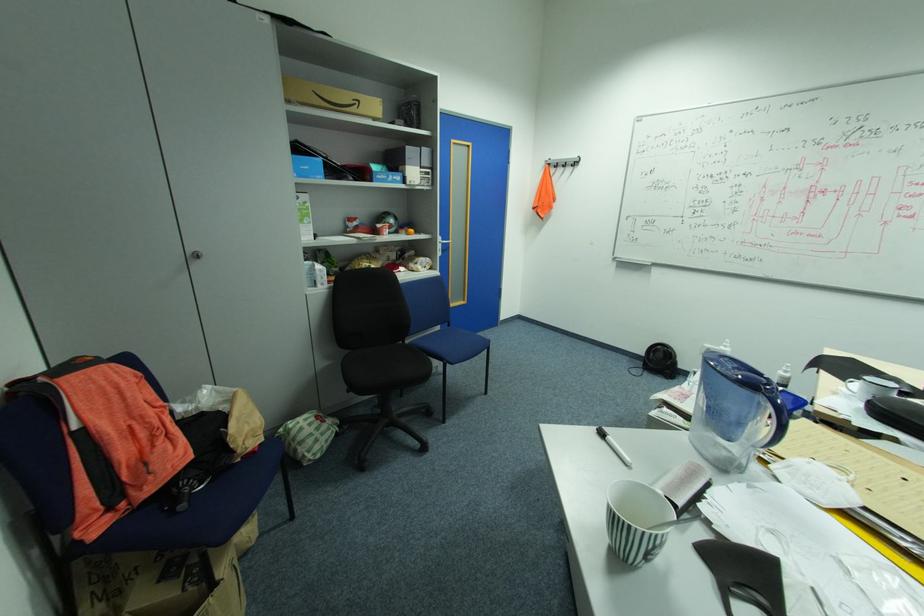
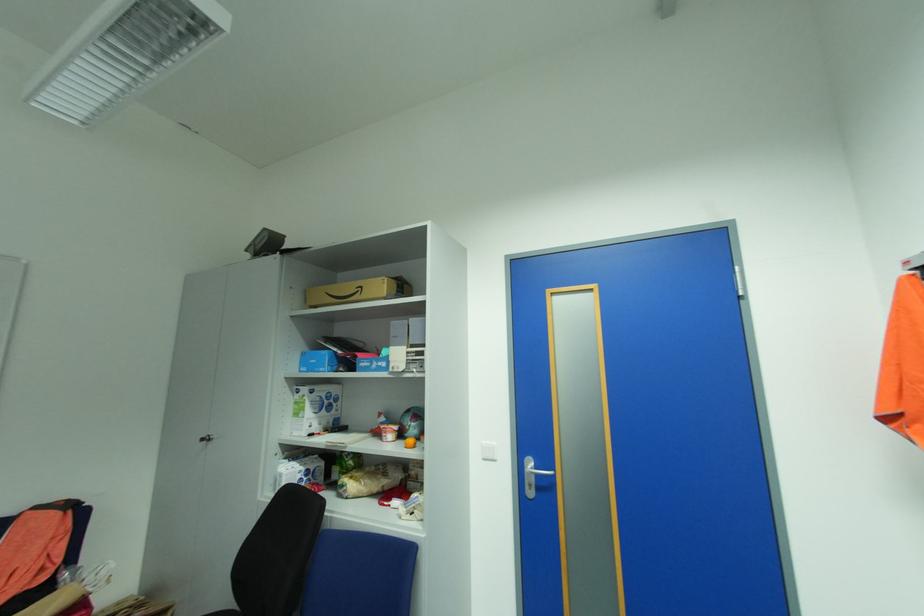
In the second image, find the point that corresponds to point 323,177 in the first image.

(327, 370)